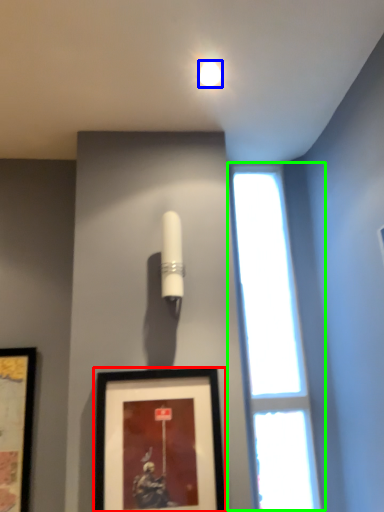
Question: Estimate the real-world distances between objects in this image. Which object is closer to picture frame (highlighted by a red box), lighting (highlighted by a blue box) or window (highlighted by a green box)?

Choices:
 (A) lighting
 (B) window

Answer: (B)